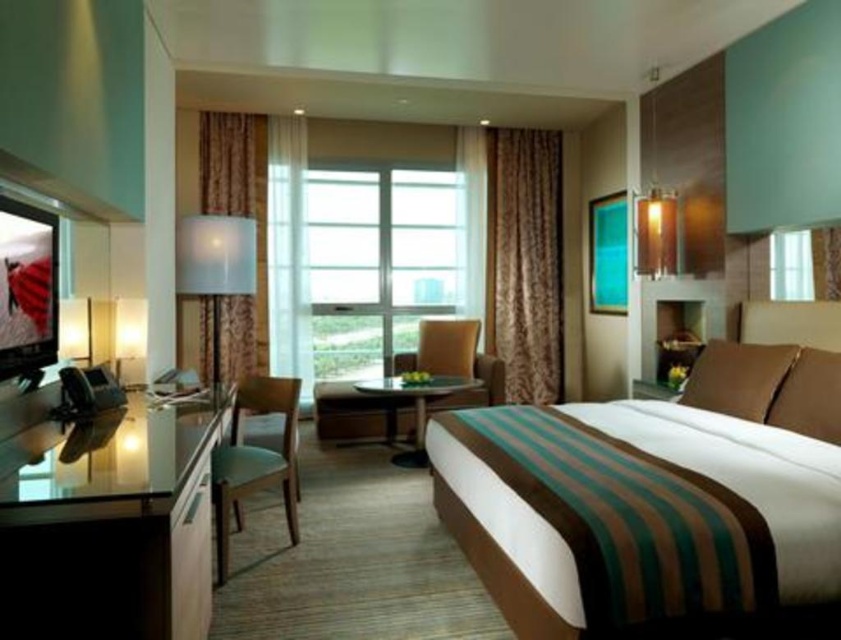
You are a guest in the hotel room and want to place a tall lamp on the clear glass table at left. Based on the height of the teal fabric chair at left, do you think the lamp will fit without hitting the chair?

The clear glass table at left is shorter than the teal fabric chair at left, so the lamp placed on the clear glass table at left will not hit the chair since the table is lower than the chair.

You are a guest in the hotel room and need to place a heavy laptop on the clear glass table at left or the teal fabric chair at left. Which surface can safely hold the laptop without risk of damage?

The clear glass table at left is located above the teal fabric chair at left, so the clear glass table at left is the appropriate surface to place the heavy laptop since it is designed to hold items and is positioned higher, likely more stable than the chair.